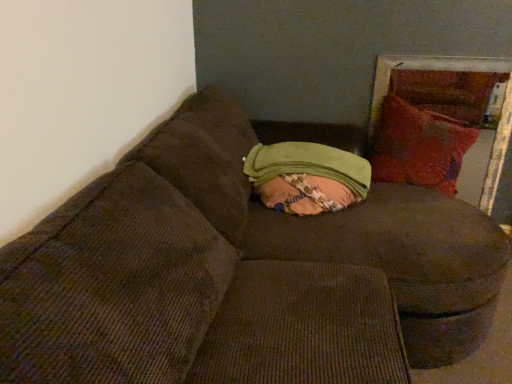
Question: Is green fabric bean bag at center surrounded by velvet red pillow at right?

Choices:
 (A) no
 (B) yes

Answer: (A)

Question: Is velvet red pillow at right not within green fabric bean bag at center?

Choices:
 (A) yes
 (B) no

Answer: (A)

Question: Is velvet red pillow at right to the left of green fabric bean bag at center from the viewer's perspective?

Choices:
 (A) no
 (B) yes

Answer: (A)

Question: From a real-world perspective, is velvet red pillow at right located higher than green fabric bean bag at center?

Choices:
 (A) no
 (B) yes

Answer: (B)

Question: Does velvet red pillow at right have a smaller size compared to green fabric bean bag at center?

Choices:
 (A) no
 (B) yes

Answer: (A)

Question: From the image's perspective, is velvet red pillow at right above green fabric bean bag at center?

Choices:
 (A) yes
 (B) no

Answer: (A)

Question: Is velvet red pillow at right completely or partially inside green fabric bean bag at center?

Choices:
 (A) no
 (B) yes

Answer: (A)

Question: Is the depth of green fabric bean bag at center greater than that of velvet red pillow at right?

Choices:
 (A) no
 (B) yes

Answer: (A)

Question: Can you confirm if green fabric bean bag at center is taller than velvet red pillow at right?

Choices:
 (A) yes
 (B) no

Answer: (B)

Question: Is green fabric bean bag at center smaller than velvet red pillow at right?

Choices:
 (A) no
 (B) yes

Answer: (B)

Question: Would you consider green fabric bean bag at center to be distant from velvet red pillow at right?

Choices:
 (A) yes
 (B) no

Answer: (B)

Question: From the image's perspective, does green fabric bean bag at center appear lower than velvet red pillow at right?

Choices:
 (A) yes
 (B) no

Answer: (A)

Question: In terms of width, does green fabric bean bag at center look wider or thinner when compared to velvet red pillow at right?

Choices:
 (A) wide
 (B) thin

Answer: (A)